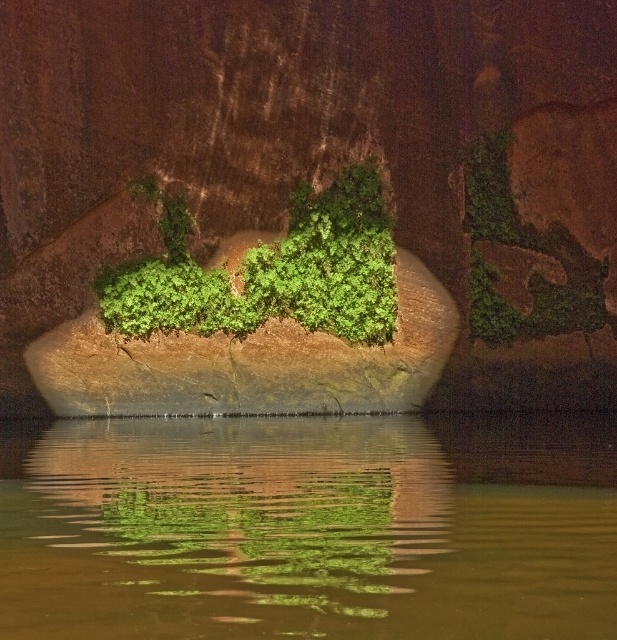
You are a photographer aiming to capture the reflection of the green leafy plant at center in the green reflective water at center. Based on the scene description, will the entire plant be visible in the water reflection?

The green reflective water at center is bigger than the green leafy plant at center, so yes, the entire plant will be visible in the water reflection since the water surface is larger than the plant.

You are a photographer aiming to capture the reflection of the green leafy plant at center in the green reflective water at center. Based on the scene description, can you fit the entire plant within the water surface to ensure its reflection is fully visible?

The green reflective water at center is wider than the green leafy plant at center, so yes, the entire plant can be captured within the water surface to ensure its reflection is fully visible.

You are a photographer aiming to capture the reflection of both the green reflective water at center and the green leafy plant at center in your shot. Which object will have a larger reflection in the water?

The green reflective water at center is taller than the green leafy plant at center, so its reflection will be larger in the water.